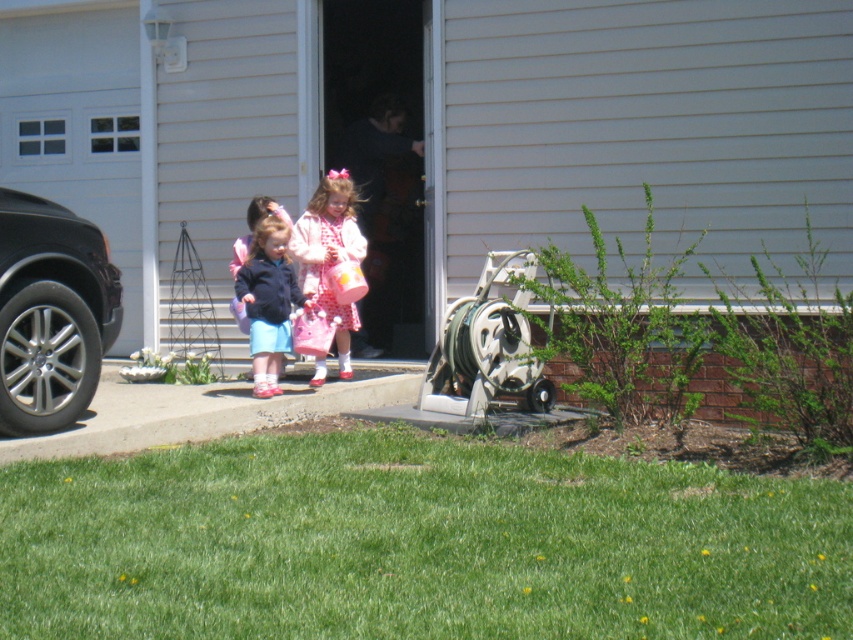
Describe the element at coordinates (51, 312) in the screenshot. The image size is (853, 640). I see `shiny black car at left` at that location.

Does point (49, 218) come farther from viewer compared to point (268, 236)?

No, (49, 218) is closer to viewer.

The width and height of the screenshot is (853, 640). I want to click on shiny black car at left, so click(51, 312).

Identify the location of shiny black car at left. pyautogui.click(x=51, y=312).

Is metallic gray hose reel at lower center taller than matte blue jacket at center?

No, metallic gray hose reel at lower center is not taller than matte blue jacket at center.

Who is taller, metallic gray hose reel at lower center or matte blue jacket at center?

Standing taller between the two is matte blue jacket at center.

The height and width of the screenshot is (640, 853). Identify the location of metallic gray hose reel at lower center. (486, 346).

Is shiny black car at left to the left of pink satin dress at center from the viewer's perspective?

Yes, shiny black car at left is to the left of pink satin dress at center.

Does shiny black car at left appear over pink satin dress at center?

Actually, shiny black car at left is below pink satin dress at center.

At what (x,y) coordinates should I click in order to perform the action: click on shiny black car at left. Please return your answer as a coordinate pair (x, y). Looking at the image, I should click on (51, 312).

Where is `shiny black car at left`? shiny black car at left is located at coordinates (51, 312).